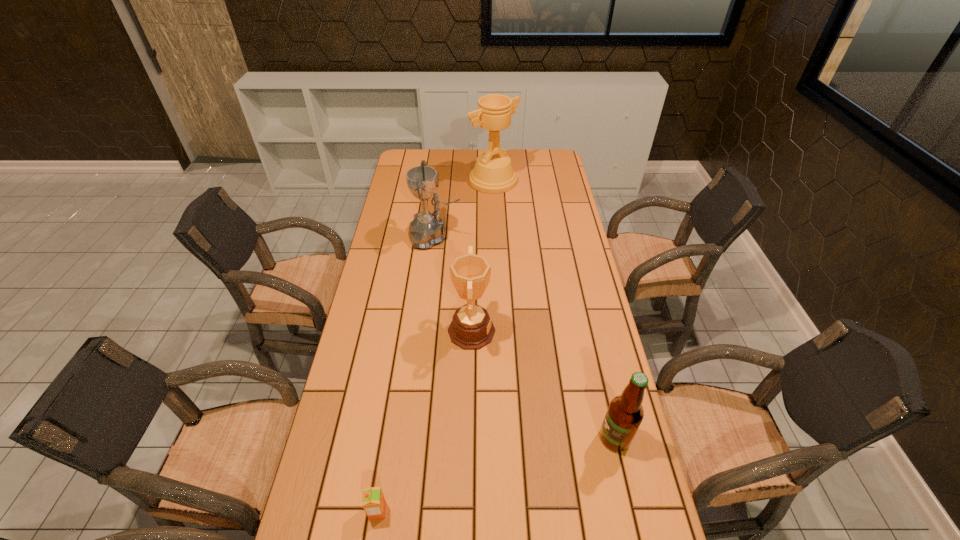
I want to click on the tallest award, so click(x=493, y=173).

This screenshot has height=540, width=960. Find the location of `the farthest award`. the farthest award is located at coordinates (493, 173).

The width and height of the screenshot is (960, 540). I want to click on the second nearest award, so click(427, 229).

Where is `the nearest award`? This screenshot has width=960, height=540. the nearest award is located at coordinates (471, 328).

Identify the location of the fourth farthest object. The height and width of the screenshot is (540, 960). (625, 413).

Where is `beer bottle`? This screenshot has width=960, height=540. beer bottle is located at coordinates (625, 413).

Where is `the nearest object`? the nearest object is located at coordinates (374, 504).

Locate an element on the screen. The image size is (960, 540). the shortest object is located at coordinates (374, 504).

Locate an element on the screen. This screenshot has height=540, width=960. blank area located 0.260m on the left of the tallest object is located at coordinates (413, 181).

Image resolution: width=960 pixels, height=540 pixels. In order to click on blank space located 0.230m on the side with emblem of the second farthest object in this screenshot , I will do `click(520, 237)`.